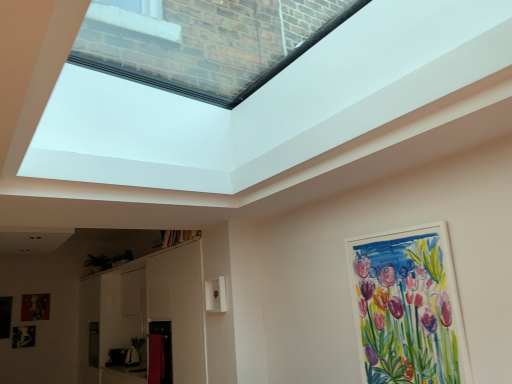
Question: Considering the relative positions of white matte picture frame at upper right, the 1th picture frame positioned from the front, and black matte picture frame at lower left, which appears as the 3th picture frame when viewed from the right, in the image provided, is white matte picture frame at upper right, the 1th picture frame positioned from the front, in front of black matte picture frame at lower left, which appears as the 3th picture frame when viewed from the right,?

Choices:
 (A) yes
 (B) no

Answer: (A)

Question: Is white matte picture frame at upper right, marked as the third picture frame in a left-to-right arrangement, facing towards black matte picture frame at lower left, placed as the second picture frame when sorted from back to front?

Choices:
 (A) no
 (B) yes

Answer: (A)

Question: From the image's perspective, is white matte picture frame at upper right, the 1th picture frame positioned from the front, above black matte picture frame at lower left, which is the 2th picture frame in front-to-back order?

Choices:
 (A) yes
 (B) no

Answer: (A)

Question: From a real-world perspective, is white matte picture frame at upper right, the third picture frame viewed from the back, physically above black matte picture frame at lower left, which appears as the 3th picture frame when viewed from the right?

Choices:
 (A) yes
 (B) no

Answer: (A)

Question: Can you confirm if white matte picture frame at upper right, marked as the third picture frame in a left-to-right arrangement, is smaller than black matte picture frame at lower left, marked as the 1th picture frame in a left-to-right arrangement?

Choices:
 (A) no
 (B) yes

Answer: (A)

Question: From the image's perspective, relative to matte wooden picture frame at lower left, marked as the first picture frame in a back-to-front arrangement, is transparent glass skylight at upper center above or below?

Choices:
 (A) above
 (B) below

Answer: (A)

Question: Is transparent glass skylight at upper center bigger or smaller than matte wooden picture frame at lower left, marked as the first picture frame in a back-to-front arrangement?

Choices:
 (A) small
 (B) big

Answer: (B)

Question: In terms of width, does transparent glass skylight at upper center look wider or thinner when compared to matte wooden picture frame at lower left, which appears as the 2th picture frame when viewed from the right?

Choices:
 (A) wide
 (B) thin

Answer: (A)

Question: Considering their positions, is transparent glass skylight at upper center located in front of or behind matte wooden picture frame at lower left, placed as the 2th picture frame when sorted from bottom to top?

Choices:
 (A) behind
 (B) front

Answer: (B)

Question: From a real-world perspective, is black matte picture frame at lower left, placed as the second picture frame when sorted from back to front, positioned above or below matte wooden picture frame at lower left, marked as the third picture frame in a front-to-back arrangement?

Choices:
 (A) below
 (B) above

Answer: (A)

Question: Which is correct: black matte picture frame at lower left, which is the 2th picture frame in front-to-back order, is inside matte wooden picture frame at lower left, marked as the first picture frame in a back-to-front arrangement, or outside of it?

Choices:
 (A) outside
 (B) inside

Answer: (A)

Question: Is black matte picture frame at lower left, placed as the second picture frame when sorted from back to front, taller or shorter than matte wooden picture frame at lower left, which appears as the 2th picture frame when viewed from the right?

Choices:
 (A) short
 (B) tall

Answer: (A)

Question: Relative to matte wooden picture frame at lower left, placed as the 2th picture frame when sorted from left to right, is black matte picture frame at lower left, marked as the 1th picture frame in a left-to-right arrangement, in front or behind?

Choices:
 (A) front
 (B) behind

Answer: (A)

Question: In terms of width, does white matte picture frame at upper right, marked as the third picture frame in a left-to-right arrangement, look wider or thinner when compared to black matte picture frame at lower left, which appears as the 3th picture frame when viewed from the right?

Choices:
 (A) thin
 (B) wide

Answer: (B)

Question: Visually, is white matte picture frame at upper right, which appears as the first picture frame when viewed from the top, positioned to the left or to the right of black matte picture frame at lower left, which is the 2th picture frame in front-to-back order?

Choices:
 (A) left
 (B) right

Answer: (B)